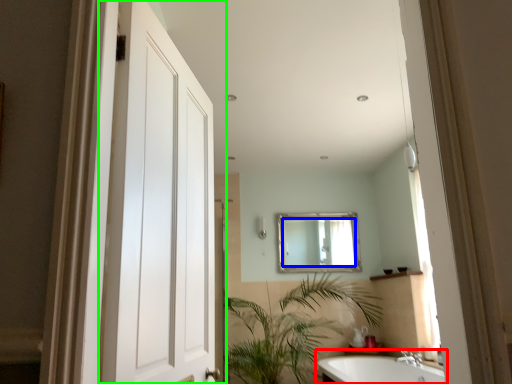
Question: Based on their relative distances, which object is farther from bathtub (highlighted by a red box)? Choose from mirror (highlighted by a blue box) and door (highlighted by a green box).

Choices:
 (A) mirror
 (B) door

Answer: (B)